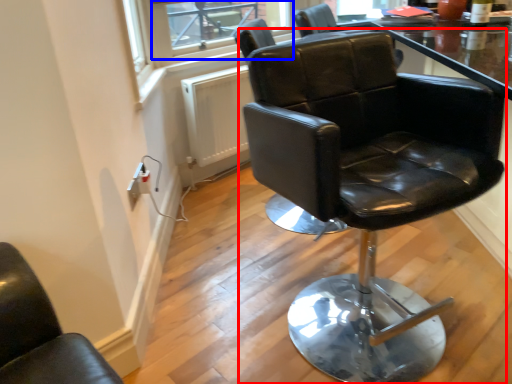
Question: Which point is further to the camera, chair (highlighted by a red box) or window screen (highlighted by a blue box)?

Choices:
 (A) chair
 (B) window screen

Answer: (B)